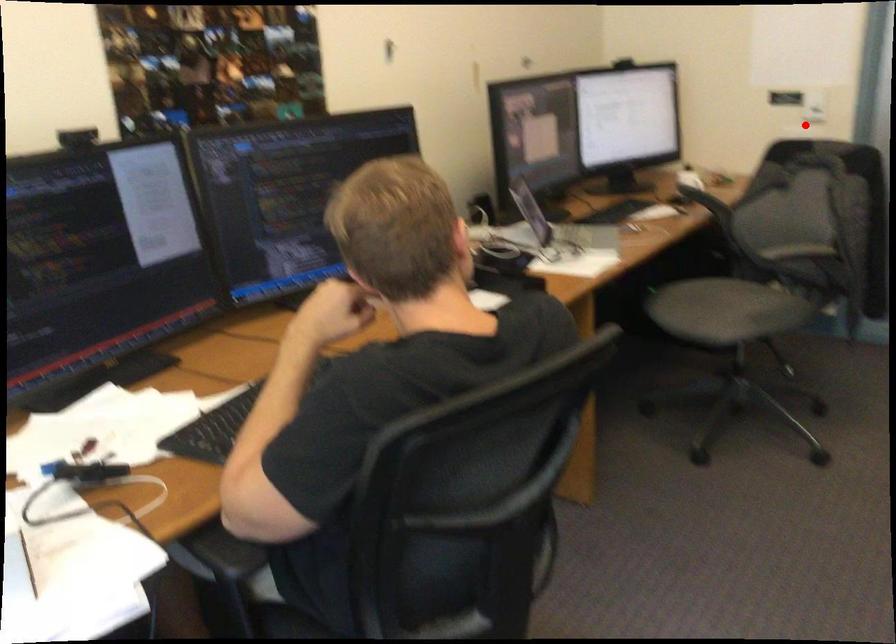
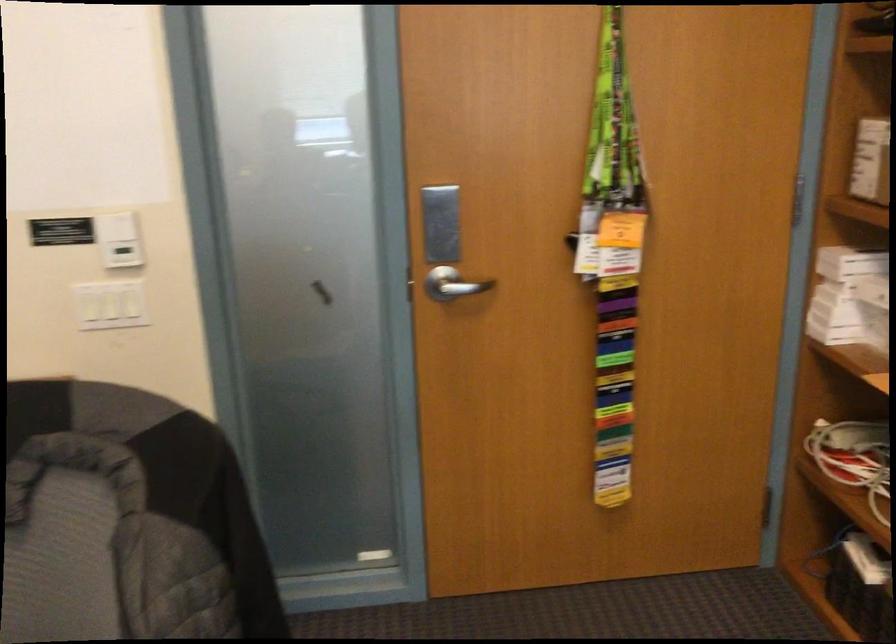
Locate, in the second image, the point that corresponds to the highlighted location in the first image.

(109, 305)